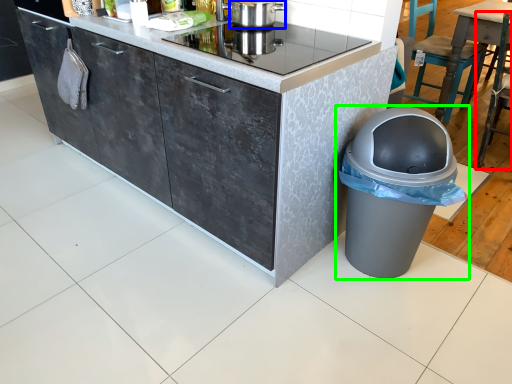
Question: Based on their relative distances, which object is farther from chair (highlighted by a red box)? Choose from kitchen appliance (highlighted by a blue box) and waste container (highlighted by a green box).

Choices:
 (A) kitchen appliance
 (B) waste container

Answer: (A)